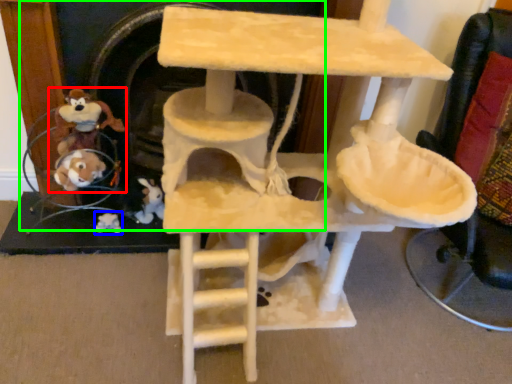
Question: Which object is the farthest from toy (highlighted by a red box)? Choose among these: toy (highlighted by a blue box) or fireplace (highlighted by a green box).

Choices:
 (A) toy
 (B) fireplace

Answer: (A)